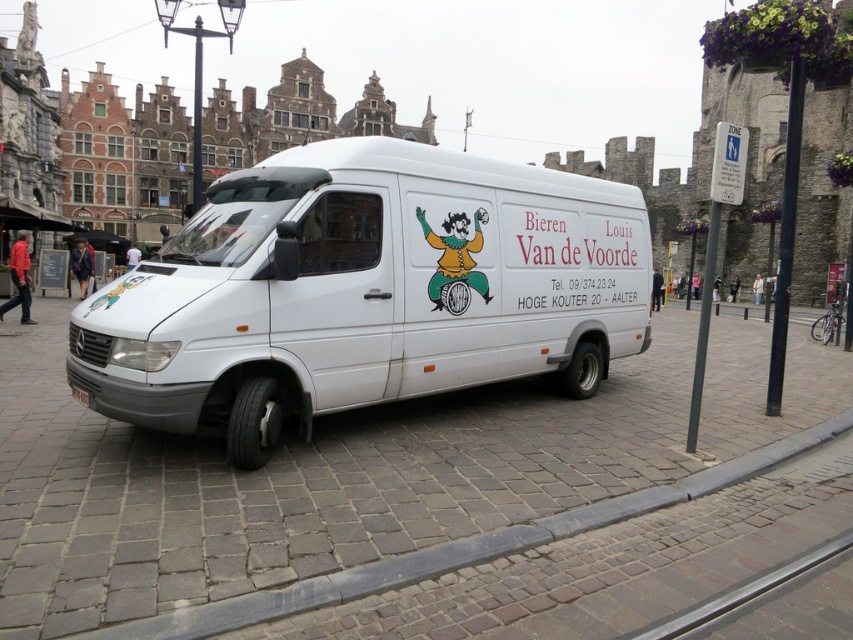
Find the location of `white matte van at center`. white matte van at center is located at coordinates (364, 291).

Does point (175, 260) come closer to viewer compared to point (341, 579)?

No, (175, 260) is behind (341, 579).

Where is `white matte van at center`? The height and width of the screenshot is (640, 853). white matte van at center is located at coordinates (364, 291).